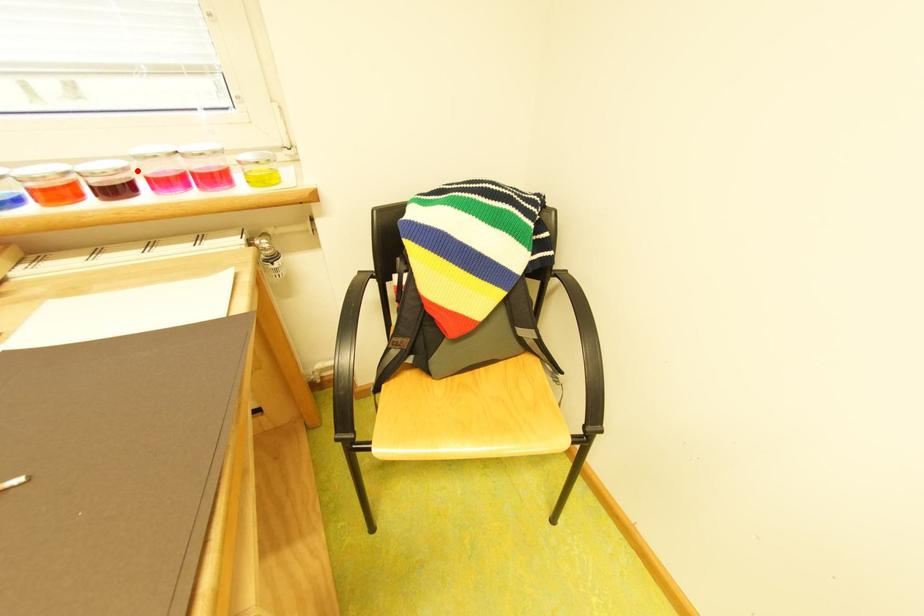
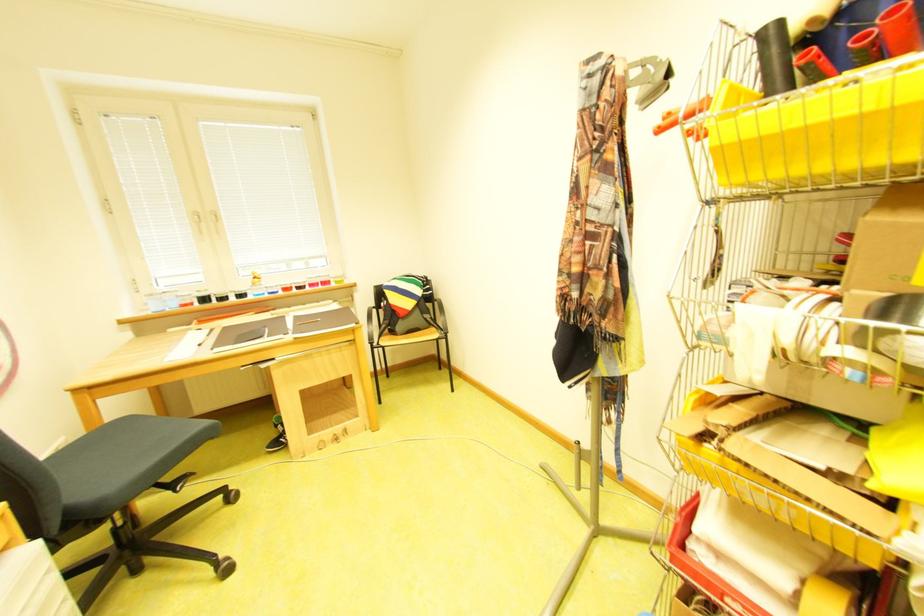
Locate, in the second image, the point that corresponds to the highlighted location in the first image.

(315, 283)